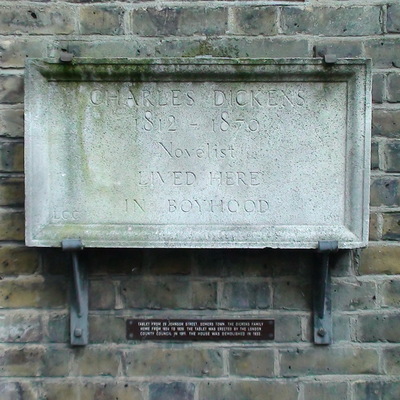
Identify the location of plaque. The width and height of the screenshot is (400, 400). (195, 332), (198, 138).